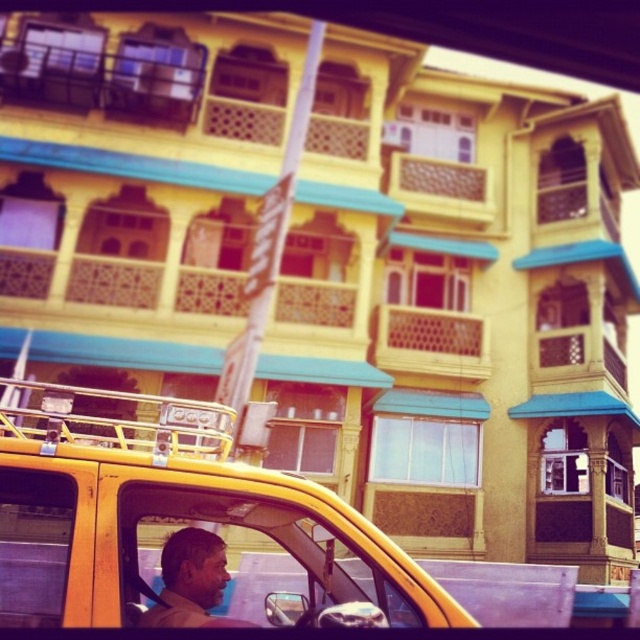
Question: Is yellow matte taxi at center below transparent glass window at lower left?

Choices:
 (A) no
 (B) yes

Answer: (A)

Question: Which point appears closest to the camera in this image?

Choices:
 (A) (28, 564)
 (B) (173, 550)
 (C) (269, 588)
 (D) (381, 554)

Answer: (D)

Question: Which object appears farthest from the camera in this image?

Choices:
 (A) transparent glass window at lower left
 (B) yellow matte taxi at center
 (C) transparent plastic window at center
 (D) matte brown skin at center

Answer: (A)

Question: Where is transparent glass window at lower left located in relation to matte brown skin at center in the image?

Choices:
 (A) above
 (B) below

Answer: (B)

Question: Is transparent plastic window at center positioned before transparent glass window at lower left?

Choices:
 (A) no
 (B) yes

Answer: (B)

Question: Among these points, which one is nearest to the camera?

Choices:
 (A) [x=240, y=529]
 (B) [x=61, y=490]
 (C) [x=202, y=586]

Answer: (B)